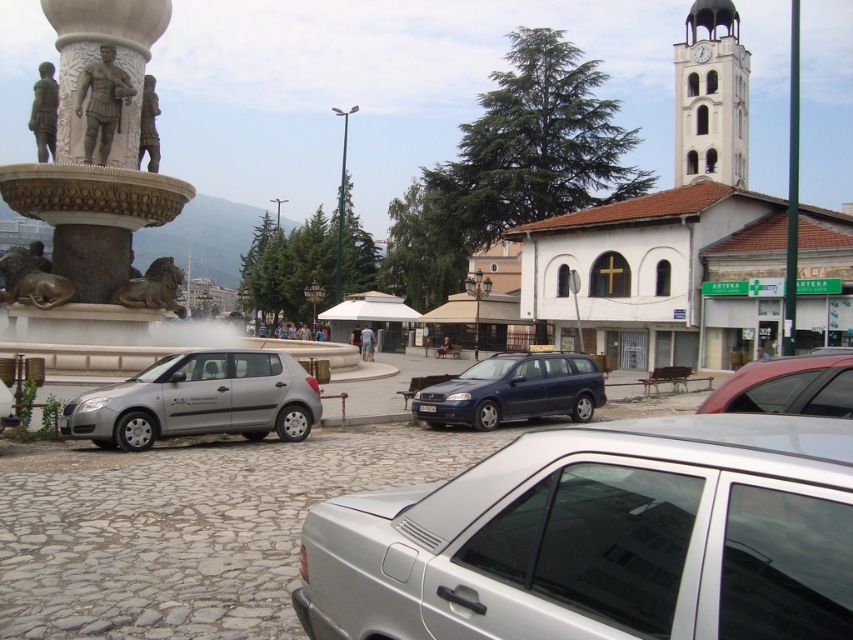
Question: Which point is closer to the camera?

Choices:
 (A) bronze statue at center
 (B) silver metallic car at center

Answer: (B)

Question: Where is silver metallic car at center located in relation to metallic red car at right in the image?

Choices:
 (A) left
 (B) right

Answer: (A)

Question: Does bronze statue at center have a larger size compared to golden polished stone lion at left?

Choices:
 (A) no
 (B) yes

Answer: (A)

Question: Is bronze statue of lion at left positioned before white marble statue at upper left?

Choices:
 (A) yes
 (B) no

Answer: (A)

Question: Considering the real-world distances, which object is closest to the bronze statue of lion at left?

Choices:
 (A) bronze statue at left
 (B) satin silver car at lower left

Answer: (A)

Question: Which point is closer to the camera?

Choices:
 (A) golden polished stone lion at left
 (B) bronze statue of lion at left
 (C) white matte church at upper center
 (D) metallic red car at right

Answer: (D)